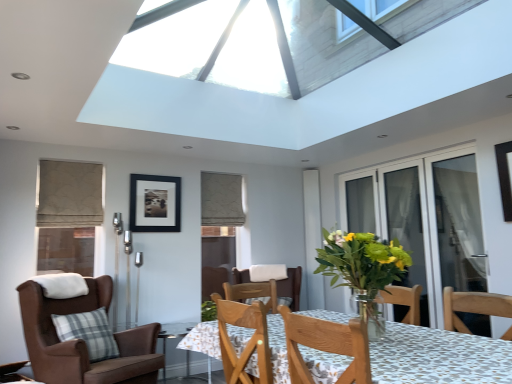
Question: Considering the relative sizes of transparent glass table at lower center and translucent glass vase at center in the image provided, is transparent glass table at lower center bigger than translucent glass vase at center?

Choices:
 (A) no
 (B) yes

Answer: (B)

Question: From the image's perspective, would you say transparent glass table at lower center is shown under translucent glass vase at center?

Choices:
 (A) yes
 (B) no

Answer: (A)

Question: Is translucent glass vase at center at the back of transparent glass table at lower center?

Choices:
 (A) no
 (B) yes

Answer: (A)

Question: Is transparent glass table at lower center smaller than translucent glass vase at center?

Choices:
 (A) yes
 (B) no

Answer: (B)

Question: Considering the relative sizes of transparent glass table at lower center and translucent glass vase at center in the image provided, is transparent glass table at lower center thinner than translucent glass vase at center?

Choices:
 (A) yes
 (B) no

Answer: (B)

Question: Considering the positions of point [454, 218] and point [187, 375], is point [454, 218] closer or farther from the camera than point [187, 375]?

Choices:
 (A) closer
 (B) farther

Answer: (A)

Question: From the image's perspective, is transparent glass door at right, the 1th screen door positioned from the front, above or below transparent glass table at lower center?

Choices:
 (A) above
 (B) below

Answer: (A)

Question: Relative to transparent glass table at lower center, is transparent glass door at right, the 1th screen door positioned from the front, in front or behind?

Choices:
 (A) behind
 (B) front

Answer: (B)

Question: Is transparent glass door at right, the 1th screen door positioned from the front, taller or shorter than transparent glass table at lower center?

Choices:
 (A) short
 (B) tall

Answer: (B)

Question: From a real-world perspective, is transparent glass screen door at right, the second screen door when ordered from front to back, physically located above or below black matte picture frame at upper center?

Choices:
 (A) above
 (B) below

Answer: (B)

Question: Considering the positions of transparent glass screen door at right, acting as the first screen door starting from the back, and black matte picture frame at upper center in the image, is transparent glass screen door at right, acting as the first screen door starting from the back, wider or thinner than black matte picture frame at upper center?

Choices:
 (A) thin
 (B) wide

Answer: (B)

Question: In the image, is transparent glass screen door at right, the second screen door when ordered from front to back, positioned in front of or behind black matte picture frame at upper center?

Choices:
 (A) behind
 (B) front

Answer: (B)

Question: Is point (408, 173) positioned closer to the camera than point (179, 196)?

Choices:
 (A) closer
 (B) farther

Answer: (A)

Question: From their relative heights in the image, would you say transparent glass screen door at right, acting as the first screen door starting from the back, is taller or shorter than transparent glass table at lower center?

Choices:
 (A) tall
 (B) short

Answer: (A)

Question: Is point (397, 309) closer or farther from the camera than point (208, 382)?

Choices:
 (A) farther
 (B) closer

Answer: (B)